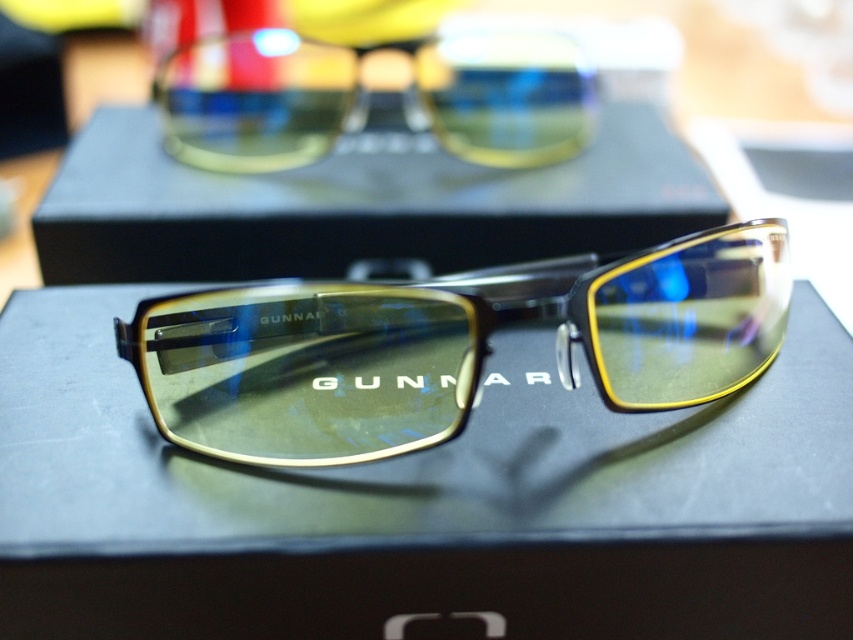
Between black matte box at center and yellow-tinted plastic goggles at upper center, which one is positioned lower?

black matte box at center is below.

Does black matte box at center appear under yellow-tinted plastic goggles at upper center?

Correct, black matte box at center is located below yellow-tinted plastic goggles at upper center.

Is point (474, 209) positioned in front of point (560, 99)?

Yes.

What are the coordinates of `black matte box at center` in the screenshot? It's located at (358, 205).

Can you confirm if matte gold frame at center is bigger than black matte box at center?

No, matte gold frame at center is not bigger than black matte box at center.

Locate an element on the screen. The height and width of the screenshot is (640, 853). matte gold frame at center is located at coordinates (448, 349).

Where is `matte gold frame at center`? Image resolution: width=853 pixels, height=640 pixels. matte gold frame at center is located at coordinates (448, 349).

Who is taller, matte gold frame at center or yellow-tinted plastic goggles at upper center?

Standing taller between the two is matte gold frame at center.

Who is lower down, matte gold frame at center or yellow-tinted plastic goggles at upper center?

matte gold frame at center is below.

You are a GUI agent. You are given a task and a screenshot of the screen. Output one action in this format:
    pyautogui.click(x=<x>, y=<y>)
    Task: Click on the matte gold frame at center
    This screenshot has height=640, width=853.
    Given the screenshot: What is the action you would take?
    pyautogui.click(x=448, y=349)

Find the location of a particular element. Image resolution: width=853 pixels, height=640 pixels. matte gold frame at center is located at coordinates (448, 349).